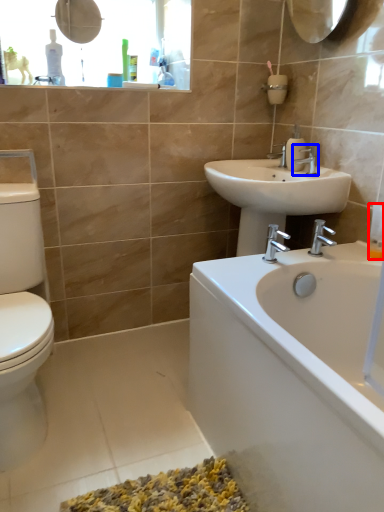
Question: Which object appears farthest to the camera in this image, toiletry (highlighted by a red box) or tap (highlighted by a blue box)?

Choices:
 (A) toiletry
 (B) tap

Answer: (B)